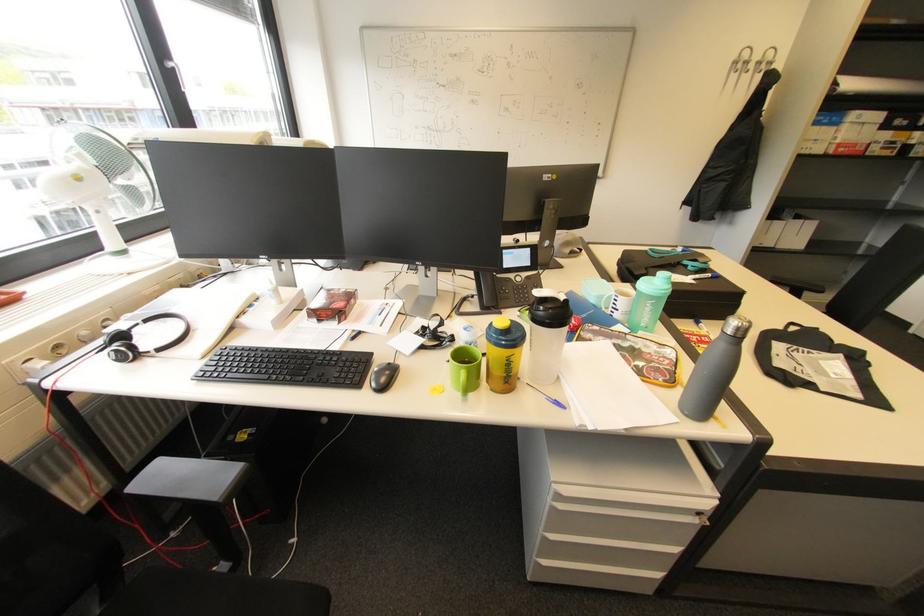
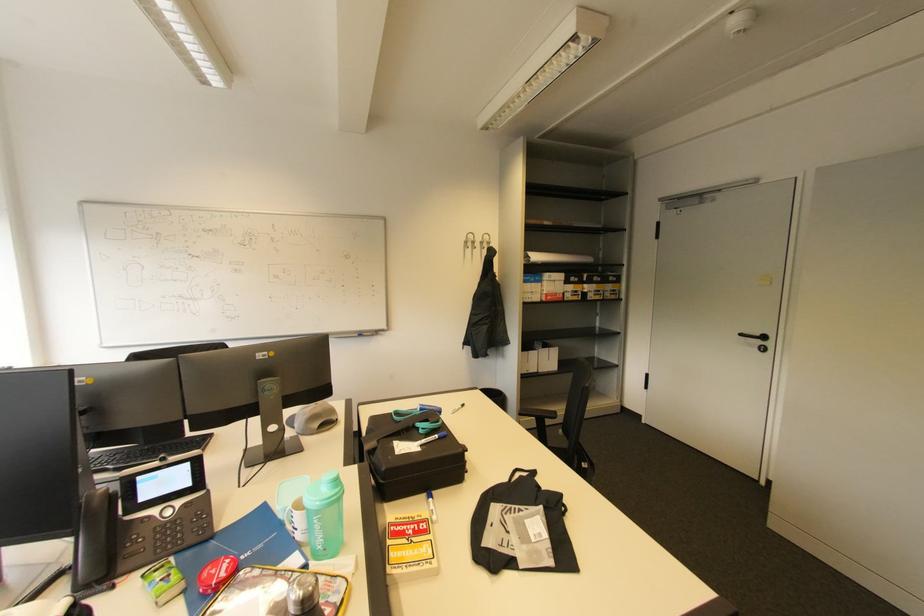
Where in the second image is the point corresponding to [825,363] from the first image?

(531, 523)